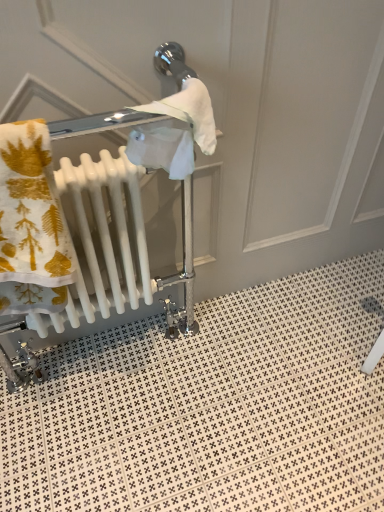
Where is `free point above white glossy tile at lower center (from a real-world perspective)`? Image resolution: width=384 pixels, height=512 pixels. free point above white glossy tile at lower center (from a real-world perspective) is located at coordinates tap(230, 400).